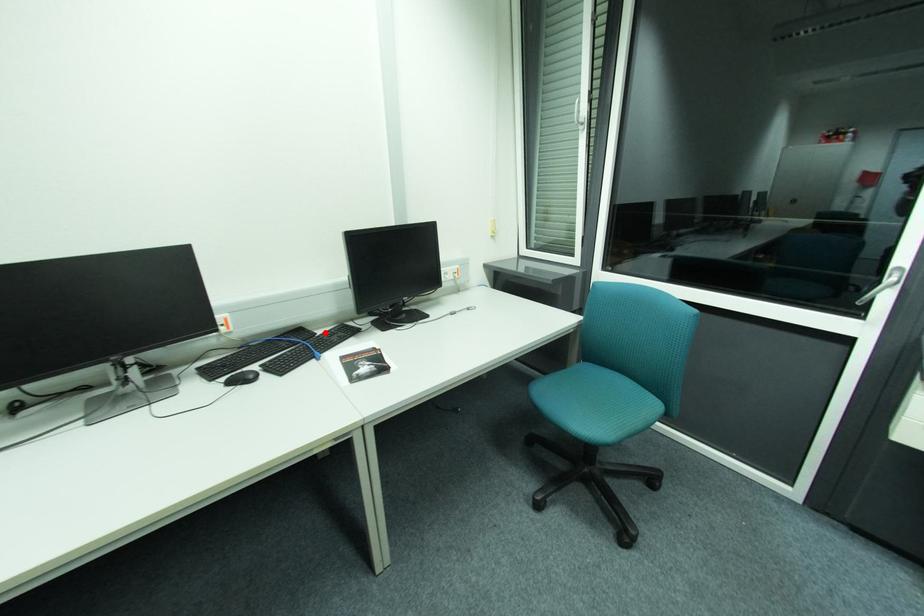
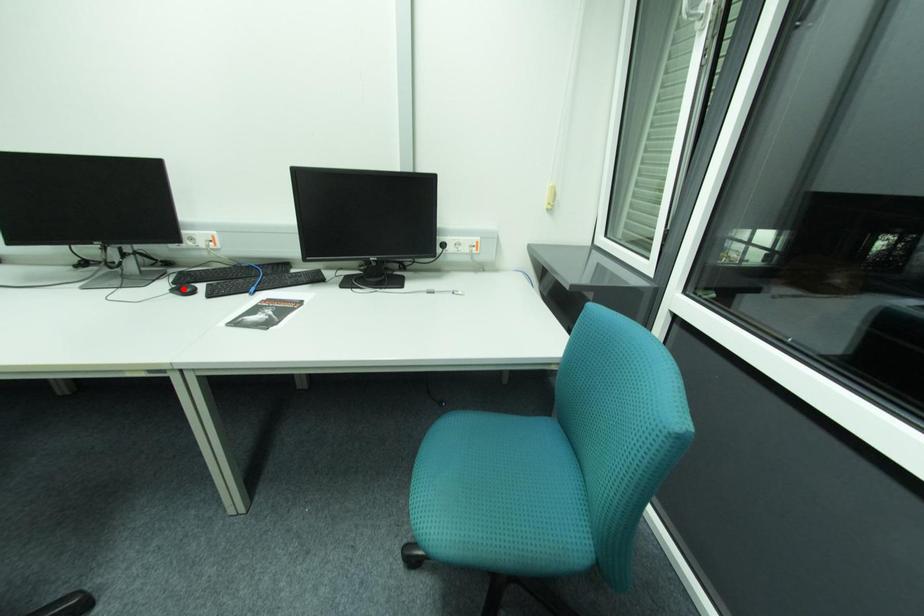
I am providing you with two images of the same scene from different viewpoints. A red point is marked on the first image and another point is marked on the second image. Is the marked point in image1 the same physical position as the marked point in image2?

No